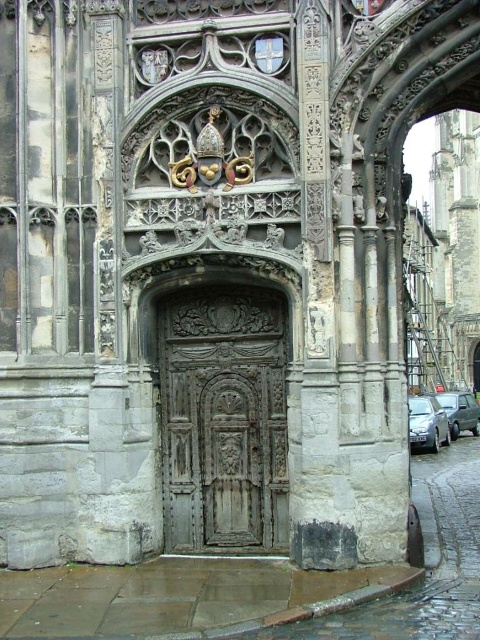
Question: Is rusty metal door at center positioned behind metallic silver van at lower right?

Choices:
 (A) yes
 (B) no

Answer: (B)

Question: Which point is closer to the camera?

Choices:
 (A) (476, 408)
 (B) (238, 445)

Answer: (B)

Question: Which is nearer to the rusty metal door at center?

Choices:
 (A) metallic silver van at lower right
 (B) silver metallic car at lower right

Answer: (B)

Question: Which object is the closest to the metallic silver van at lower right?

Choices:
 (A) rusty metal door at center
 (B) silver metallic car at lower right

Answer: (B)

Question: Does rusty metal door at center appear under silver metallic car at lower right?

Choices:
 (A) no
 (B) yes

Answer: (A)

Question: Does silver metallic car at lower right have a larger size compared to metallic silver van at lower right?

Choices:
 (A) no
 (B) yes

Answer: (B)